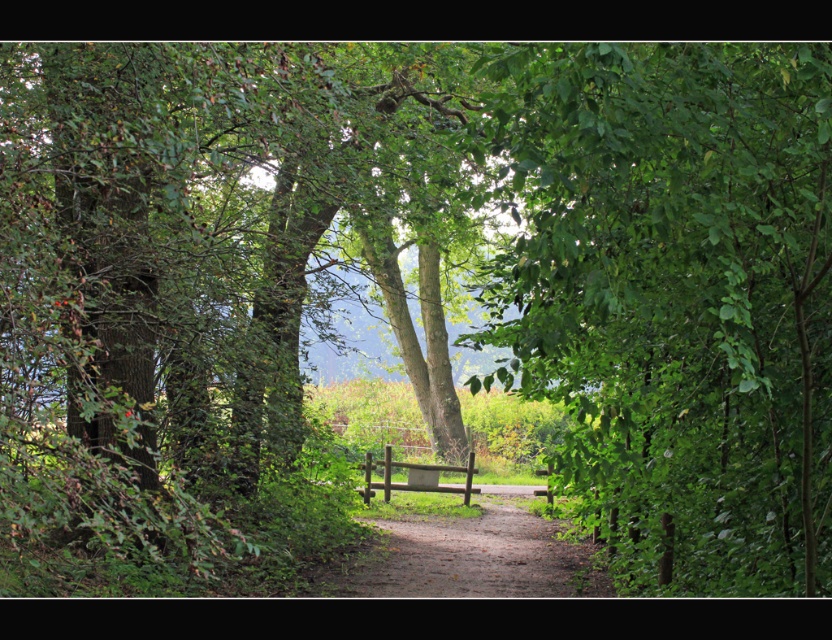
Who is higher up, green leafy tree at center or dirt/gravel path at center?

green leafy tree at center is higher up.

Can you confirm if green leafy tree at center is smaller than dirt/gravel path at center?

Yes.

The height and width of the screenshot is (640, 832). I want to click on green leafy tree at center, so click(x=675, y=298).

Does green leafy tree at center have a greater width compared to wooden bench at center?

Incorrect, green leafy tree at center's width does not surpass wooden bench at center's.

Describe the element at coordinates (675, 298) in the screenshot. I see `green leafy tree at center` at that location.

Identify the location of green leafy tree at center. This screenshot has height=640, width=832. (675, 298).

Which is below, dirt/gravel path at center or wooden bench at center?

dirt/gravel path at center

Is dirt/gravel path at center bigger than wooden bench at center?

Indeed, dirt/gravel path at center has a larger size compared to wooden bench at center.

What do you see at coordinates (473, 556) in the screenshot?
I see `dirt/gravel path at center` at bounding box center [473, 556].

The image size is (832, 640). Identify the location of dirt/gravel path at center. (473, 556).